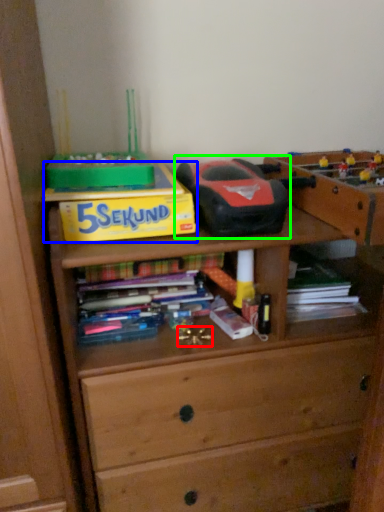
Question: Which is nearer to the toy (highlighted by a red box)? paperback book (highlighted by a blue box) or toy (highlighted by a green box).

Choices:
 (A) paperback book
 (B) toy

Answer: (A)